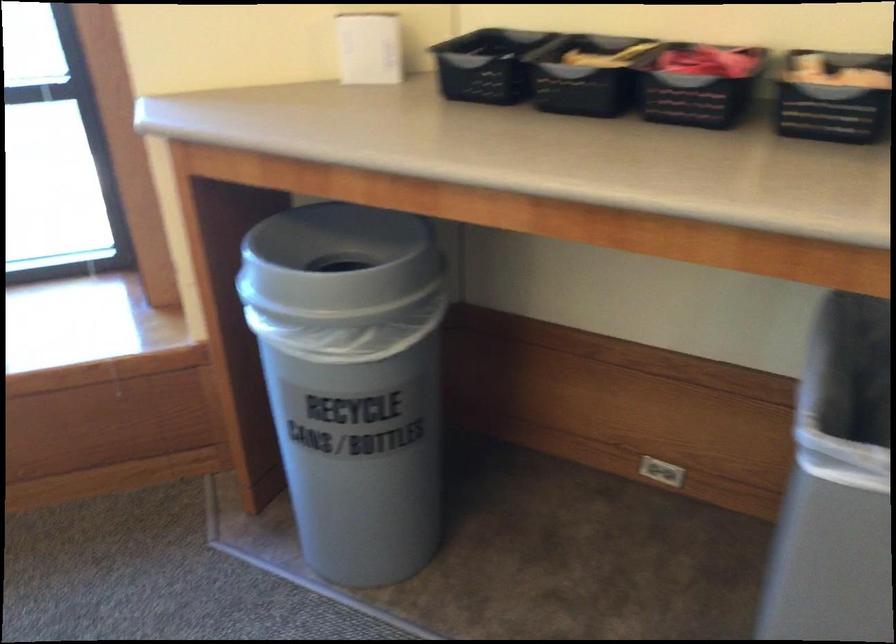
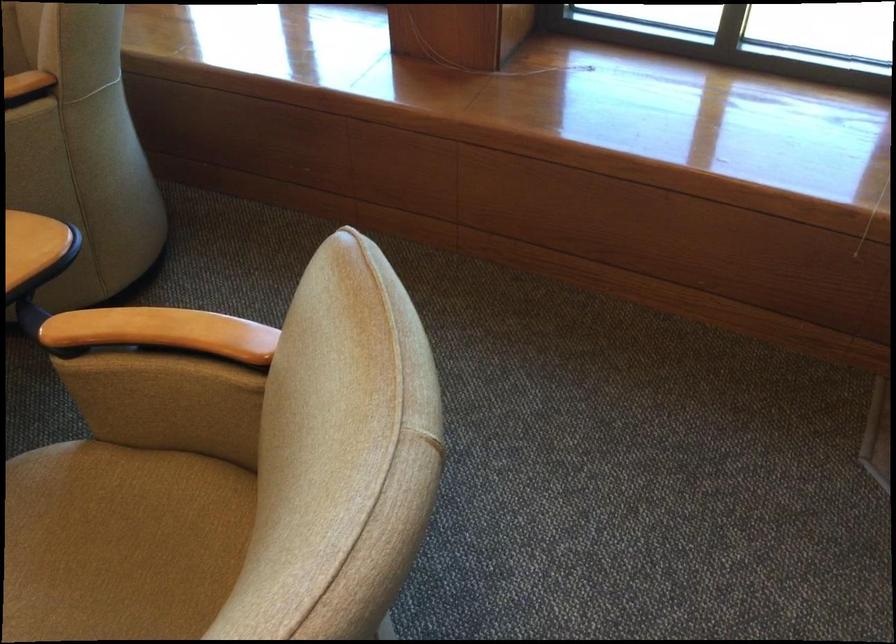
First-person continuous shooting, in which direction is the camera rotating?

The camera's rotation is toward left-down.